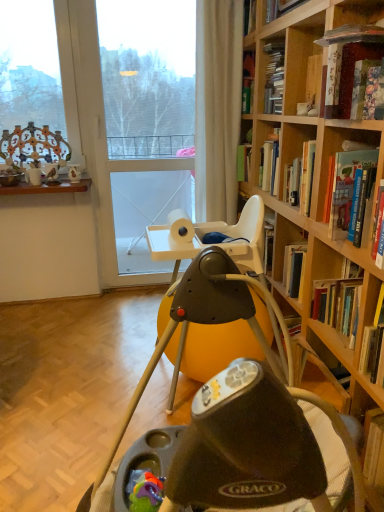
Question: Is matte black swing at center turned away from transparent glass door at center?

Choices:
 (A) no
 (B) yes

Answer: (A)

Question: Is transparent glass door at center a part of matte black swing at center?

Choices:
 (A) yes
 (B) no

Answer: (B)

Question: Is matte black swing at center positioned behind transparent glass door at center?

Choices:
 (A) yes
 (B) no

Answer: (B)

Question: From a real-world perspective, is matte black swing at center physically below transparent glass door at center?

Choices:
 (A) no
 (B) yes

Answer: (B)

Question: Does matte black swing at center appear on the left side of transparent glass door at center?

Choices:
 (A) no
 (B) yes

Answer: (A)

Question: Is matte black swing at center not near transparent glass door at center?

Choices:
 (A) no
 (B) yes

Answer: (B)

Question: Considering the relative sizes of rubberized plastic teether at lower center and beige fabric curtain at upper center in the image provided, is rubberized plastic teether at lower center shorter than beige fabric curtain at upper center?

Choices:
 (A) no
 (B) yes

Answer: (B)

Question: Can you confirm if rubberized plastic teether at lower center is positioned to the right of beige fabric curtain at upper center?

Choices:
 (A) no
 (B) yes

Answer: (A)

Question: From a real-world perspective, is rubberized plastic teether at lower center under beige fabric curtain at upper center?

Choices:
 (A) yes
 (B) no

Answer: (A)

Question: Can beige fabric curtain at upper center be found inside rubberized plastic teether at lower center?

Choices:
 (A) no
 (B) yes

Answer: (A)

Question: Is rubberized plastic teether at lower center positioned far away from beige fabric curtain at upper center?

Choices:
 (A) no
 (B) yes

Answer: (B)

Question: Considering the relative positions of rubberized plastic teether at lower center and beige fabric curtain at upper center in the image provided, is rubberized plastic teether at lower center to the left of beige fabric curtain at upper center from the viewer's perspective?

Choices:
 (A) yes
 (B) no

Answer: (A)

Question: Can we say hardcover book at upper right, the second book in the top-to-bottom sequence, lies outside transparent glass door at center?

Choices:
 (A) yes
 (B) no

Answer: (A)